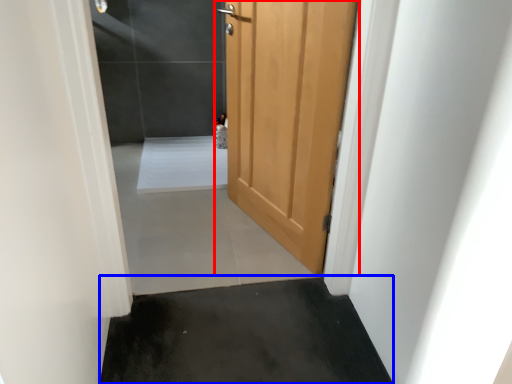
Question: Among these objects, which one is farthest to the camera, door (highlighted by a red box) or concrete (highlighted by a blue box)?

Choices:
 (A) door
 (B) concrete

Answer: (A)